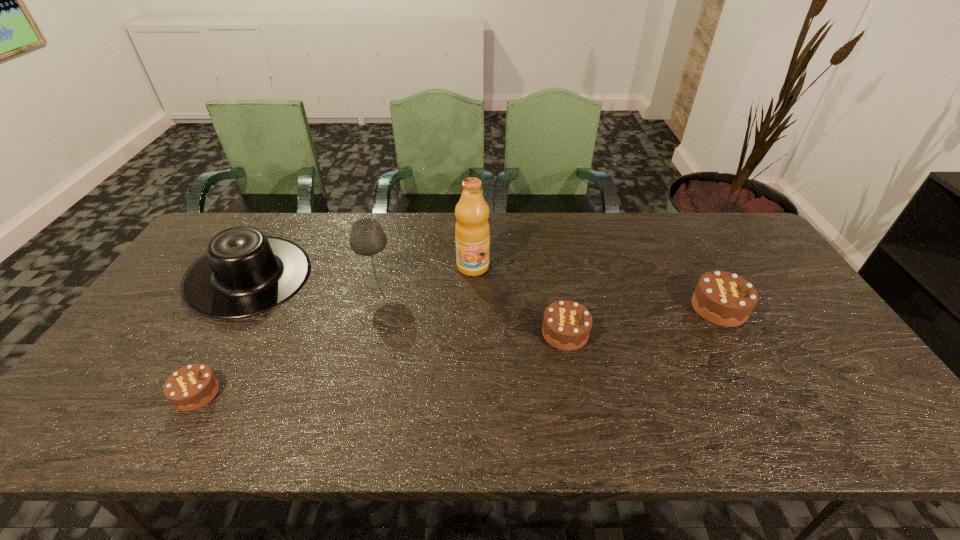
Locate an element on the screen. The image size is (960, 540). object located at the far left corner is located at coordinates (243, 273).

The width and height of the screenshot is (960, 540). In the image, there is a desktop. Identify the location of vacant space at the far edge. (553, 248).

Locate an element on the screen. free space at the near edge of the desktop is located at coordinates (562, 390).

At what (x,y) coordinates should I click in order to perform the action: click on vacant position at the left edge of the desktop. Please return your answer as a coordinate pair (x, y). Looking at the image, I should click on click(163, 359).

Where is `free spot at the far right corner of the desktop`? The image size is (960, 540). free spot at the far right corner of the desktop is located at coordinates (698, 220).

Identify the location of vacant area between the second chocolate cake from left to right and the shortest object. (381, 363).

The height and width of the screenshot is (540, 960). Find the location of `unoccupied area between the tallest object and the nearest object`. unoccupied area between the tallest object and the nearest object is located at coordinates (335, 330).

Find the location of a particular element. Image resolution: width=960 pixels, height=540 pixels. empty location between the dress hat and the second shortest chocolate cake is located at coordinates (407, 305).

The width and height of the screenshot is (960, 540). I want to click on blank region between the wineglass and the fourth object from left to right, so 424,274.

Find the location of a particular element. The height and width of the screenshot is (540, 960). vacant point located between the wineglass and the third shortest object is located at coordinates [x=548, y=294].